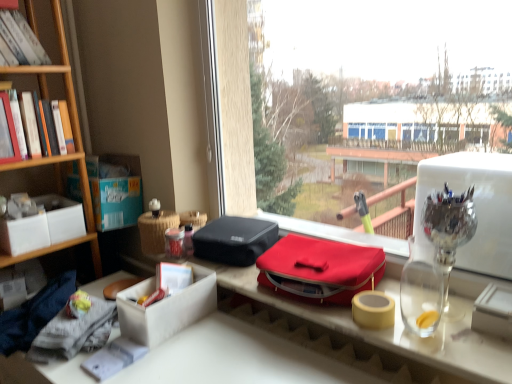
Where is `free spot in front of transparent glass pen holder at upper right`? This screenshot has width=512, height=384. free spot in front of transparent glass pen holder at upper right is located at coordinates (462, 348).